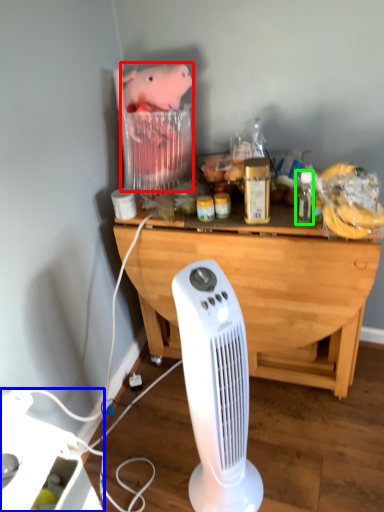
Question: Which is farther away from animal (highlighted by a red box)? appliance (highlighted by a blue box) or bottle (highlighted by a green box)?

Choices:
 (A) appliance
 (B) bottle

Answer: (A)